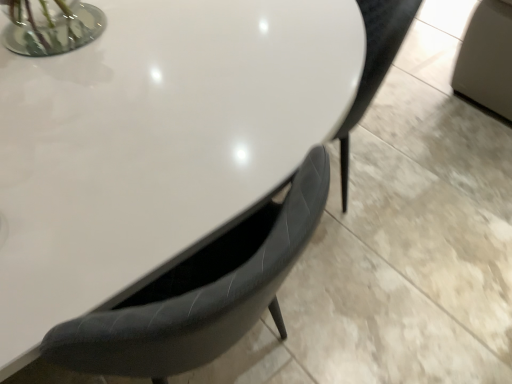
The image size is (512, 384). Find the location of `vacant area that is situated to the right of white glossy table at center`. vacant area that is situated to the right of white glossy table at center is located at coordinates (377, 296).